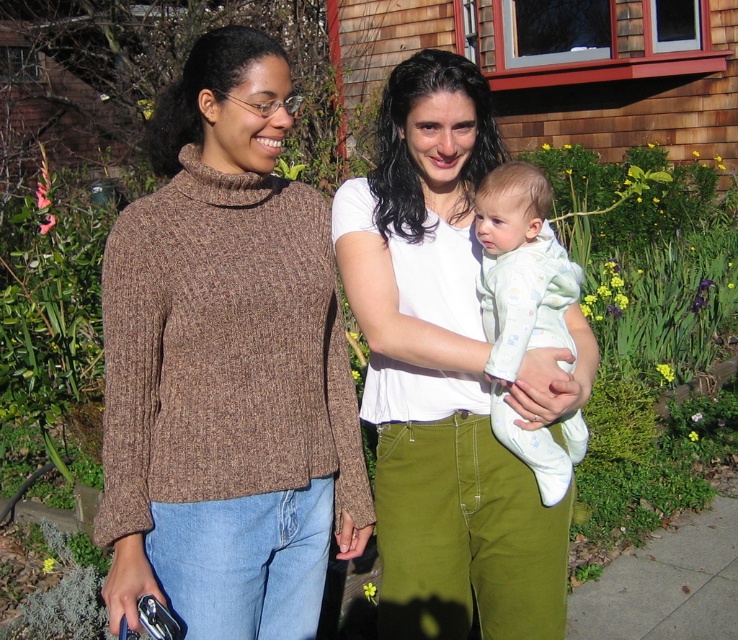
You are a delivery person trying to determine the best path to avoid stepping on the light blue cotton onesie at center and the gray concrete sidewalk at lower right. Which object should you avoid stepping on to ensure you don not damage it?

The light blue cotton onesie at center is thinner than the gray concrete sidewalk at lower right, so you should avoid stepping on the light blue cotton onesie at center to prevent damage.

You are a photographer trying to capture a photo of the light blue cotton onesie at center and the gray concrete sidewalk at lower right. Since you want both to be in focus, which object should you focus on first to ensure the other remains sharp?

The light blue cotton onesie at center has a greater height compared to gray concrete sidewalk at lower right, so you should focus on the light blue cotton onesie at center first to ensure the gray concrete sidewalk at lower right stays sharp.

You are a photographer trying to capture a clear shot of the brown knitted sweater at left and the gray concrete sidewalk at lower right. Which object should you focus on first if you want the other to be slightly out of focus?

You should focus on the brown knitted sweater at left first because it is in front of the gray concrete sidewalk at lower right, so if you focus on the sweater, the sidewalk will naturally be slightly out of focus.